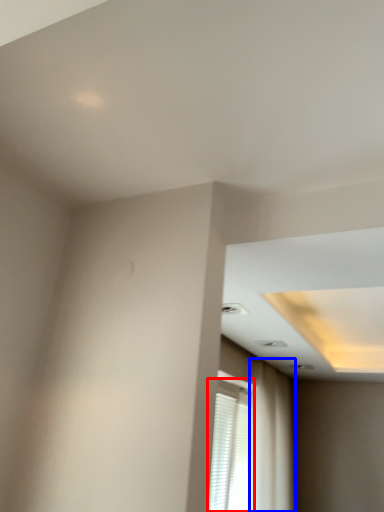
Question: Which object appears farthest to the camera in this image, window (highlighted by a red box) or curtain (highlighted by a blue box)?

Choices:
 (A) window
 (B) curtain

Answer: (B)